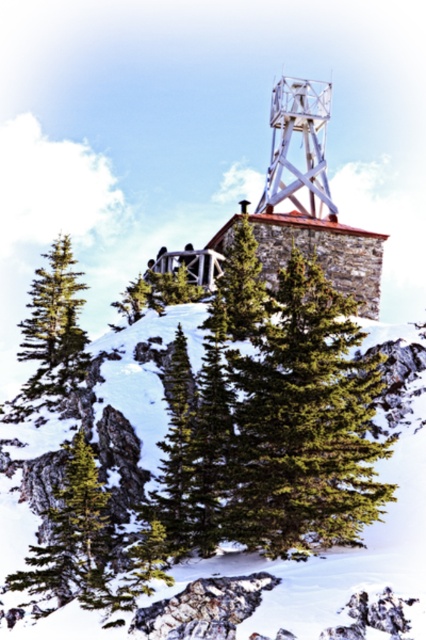
Does green matte tree at lower left have a lesser width compared to green matte tree at center?

Incorrect, green matte tree at lower left's width is not less than green matte tree at center's.

I want to click on green matte tree at lower left, so coord(89,545).

Locate an element on the screen. This screenshot has height=640, width=426. green matte tree at lower left is located at coordinates (89, 545).

Looking at this image, who is shorter, white fluffy snow at center or green matte tree at center?

green matte tree at center is shorter.

Describe the element at coordinates (359, 532) in the screenshot. The height and width of the screenshot is (640, 426). I see `white fluffy snow at center` at that location.

I want to click on white fluffy snow at center, so click(359, 532).

Is point (34, 554) farther from camera compared to point (317, 120)?

No, (34, 554) is in front of (317, 120).

Can you confirm if green matte tree at lower left is thinner than metallic white tower at upper center?

No, green matte tree at lower left is not thinner than metallic white tower at upper center.

Find the location of a particular element. The width and height of the screenshot is (426, 640). green matte tree at lower left is located at coordinates (89, 545).

Locate an element on the screen. The image size is (426, 640). green matte tree at lower left is located at coordinates (89, 545).